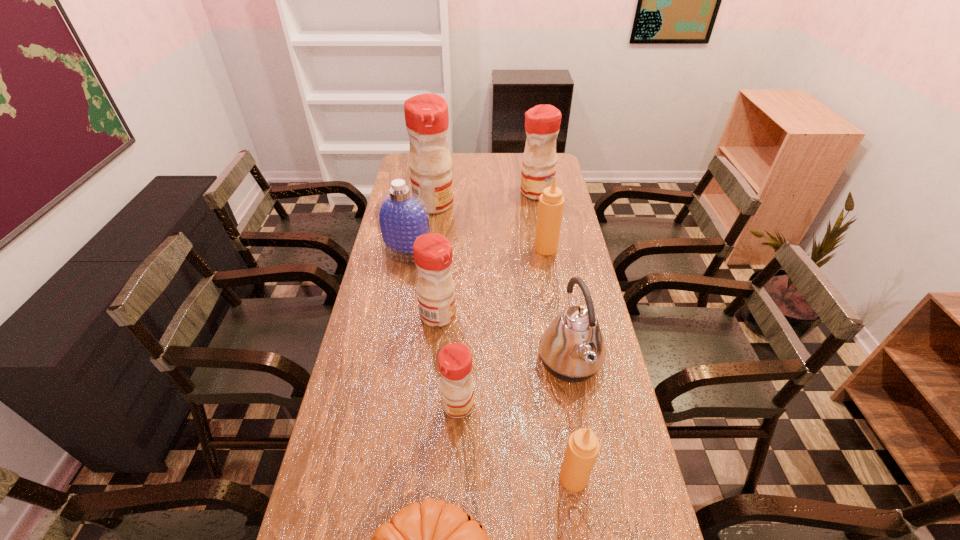
This screenshot has height=540, width=960. What are the coordinates of `the fifth farthest condiment` in the screenshot? It's located at (455, 359).

Locate an element on the screen. the nearest red condiment is located at coordinates (455, 359).

I want to click on the eighth farthest object, so click(583, 447).

Where is `the nearer tan condiment`? The width and height of the screenshot is (960, 540). the nearer tan condiment is located at coordinates (583, 447).

Identify the location of free space located 0.350m on the back of the tallest object. (441, 154).

The width and height of the screenshot is (960, 540). Find the location of `vacant space located on the back of the second tallest condiment`. vacant space located on the back of the second tallest condiment is located at coordinates (531, 159).

Image resolution: width=960 pixels, height=540 pixels. What are the coordinates of `vacant space located 0.150m on the left of the farther tan condiment` in the screenshot? It's located at (493, 248).

The height and width of the screenshot is (540, 960). I want to click on vacant region located on the back of the second smallest red condiment, so click(446, 230).

Locate an element on the screen. Image resolution: width=960 pixels, height=540 pixels. free space located 0.260m on the left of the kettle is located at coordinates (447, 362).

Where is `vacant space situated 0.400m on the front of the cleansing agent`? This screenshot has width=960, height=540. vacant space situated 0.400m on the front of the cleansing agent is located at coordinates (388, 357).